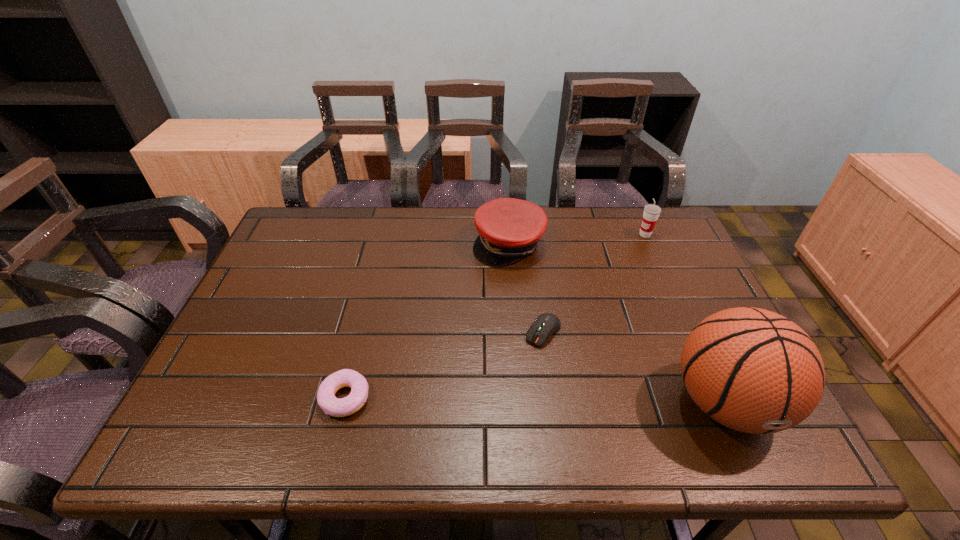
At what (x,y) coordinates should I click in order to perform the action: click on unoccupied area between the second tallest object and the tallest object. Please return your answer as a coordinate pair (x, y). Looking at the image, I should click on (x=685, y=319).

Identify the location of blank region between the cup and the cap. (577, 239).

Identify the location of vacant region between the second tallest object and the basketball. (x=685, y=319).

Identify the location of vacant space in between the cup and the third tallest object. The width and height of the screenshot is (960, 540). (577, 239).

Locate an element on the screen. The image size is (960, 540). vacant point located between the leftmost object and the cup is located at coordinates (495, 316).

You are a GUI agent. You are given a task and a screenshot of the screen. Output one action in this format:
    pyautogui.click(x=<x>, y=<y>)
    Task: Click on the empty space that is in between the third nearest object and the basketball
    
    Given the screenshot: What is the action you would take?
    pyautogui.click(x=635, y=367)

Choose which object is the third nearest neighbor to the tallest object. Please provide its 2D coordinates. Your answer should be formatted as a tuple, i.e. [(x, y)], where the tuple contains the x and y coordinates of a point satisfying the conditions above.

[(651, 212)]

Locate which object is the fourth closest to the cap. Please provide its 2D coordinates. Your answer should be formatted as a tuple, i.e. [(x, y)], where the tuple contains the x and y coordinates of a point satisfying the conditions above.

[(326, 399)]

Find the location of a particular element. The height and width of the screenshot is (540, 960). vacant point that satisfies the following two spatial constraints: 1. on the back side of the cap; 2. on the left side of the fourth shortest object is located at coordinates (508, 234).